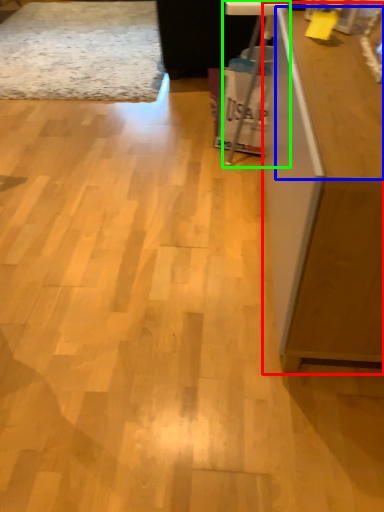
Question: Based on their relative distances, which object is farther from furniture (highlighted by a red box)? Choose from counter top (highlighted by a blue box) and computer desk (highlighted by a green box).

Choices:
 (A) counter top
 (B) computer desk

Answer: (B)